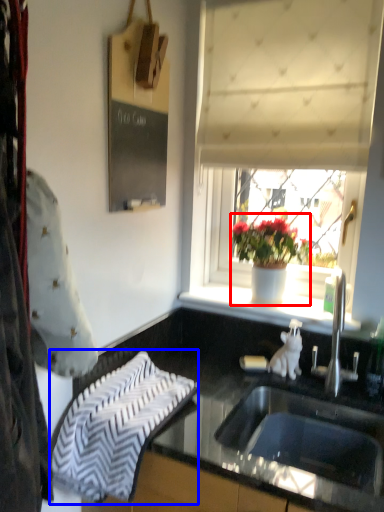
Question: Which object appears closest to the camera in this image, houseplant (highlighted by a red box) or beach towel (highlighted by a blue box)?

Choices:
 (A) houseplant
 (B) beach towel

Answer: (B)